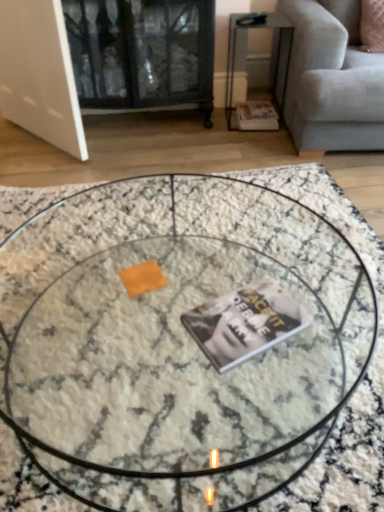
Question: In terms of height, does marble textured coffee table at center look taller or shorter compared to metallic silver side table at upper right?

Choices:
 (A) tall
 (B) short

Answer: (B)

Question: Considering their positions, is marble textured coffee table at center located in front of or behind metallic silver side table at upper right?

Choices:
 (A) behind
 (B) front

Answer: (B)

Question: Which object is the farthest from the hardcover book at center, which ranks as the second magazine in top-to-bottom order?

Choices:
 (A) light gray fabric couch at upper right
 (B) matte paper magazine at lower right, marked as the 2th magazine in a front-to-back arrangement
 (C) marble textured coffee table at center
 (D) metallic silver side table at upper right

Answer: (D)

Question: Which object is the farthest from the metallic silver side table at upper right?

Choices:
 (A) light gray fabric couch at upper right
 (B) marble textured coffee table at center
 (C) matte paper magazine at lower right, the first magazine positioned from the right
 (D) hardcover book at center, arranged as the second magazine when viewed from the right

Answer: (D)